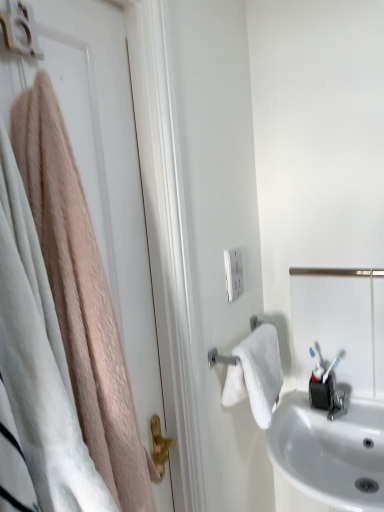
Question: In terms of size, does satin silver mirror at right appear bigger or smaller than white matte door at left?

Choices:
 (A) big
 (B) small

Answer: (B)

Question: Is satin silver mirror at right in front of or behind white matte door at left in the image?

Choices:
 (A) behind
 (B) front

Answer: (A)

Question: Which of these objects is positioned farthest from the white glossy sink at lower right?

Choices:
 (A) white plastic outlet at center
 (B) white matte door at left
 (C) satin silver mirror at right

Answer: (B)

Question: Considering the real-world distances, which object is farthest from the white glossy sink at lower right?

Choices:
 (A) white matte door at left
 (B) white plastic outlet at center
 (C) satin silver mirror at right

Answer: (A)